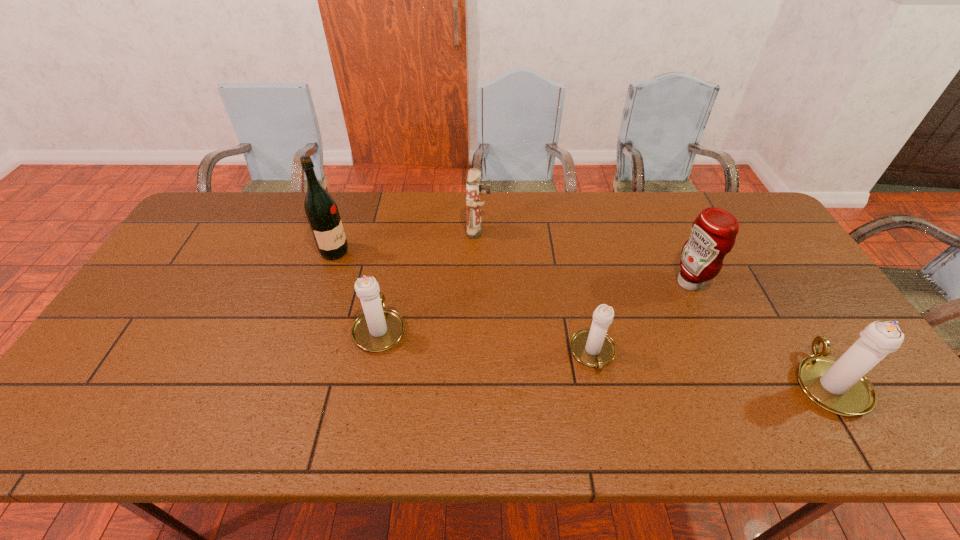
You are a GUI agent. You are given a task and a screenshot of the screen. Output one action in this format:
    pyautogui.click(x=<x>, y=<y>)
    Task: Click on the leftmost candle holder
    
    Given the screenshot: What is the action you would take?
    pyautogui.click(x=378, y=329)

Find the location of a particular element. This screenshot has width=960, height=540. the fifth object from right to left is located at coordinates (378, 329).

Find the location of a particular element. the shortest object is located at coordinates pos(592,347).

What are the coordinates of `the fourth object from left to right` in the screenshot? It's located at (592, 347).

This screenshot has width=960, height=540. I want to click on the rightmost candle holder, so click(839, 385).

The height and width of the screenshot is (540, 960). I want to click on the leftmost object, so click(322, 213).

Find the location of a particular element. This screenshot has height=540, width=960. the fifth nearest object is located at coordinates (322, 213).

The image size is (960, 540). What are the coordinates of `the farthest object` in the screenshot? It's located at (473, 204).

At what (x,y) coordinates should I click in order to perform the action: click on the third object from left to right. Please return your answer as a coordinate pair (x, y). Looking at the image, I should click on (473, 204).

The image size is (960, 540). In order to click on the fourth nearest object in this screenshot , I will do `click(713, 233)`.